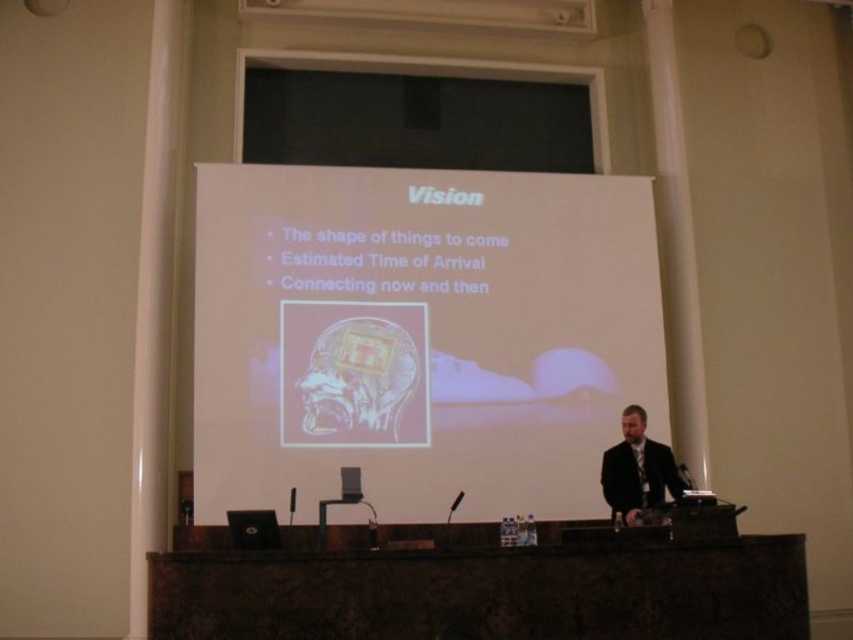
Can you confirm if white matte projection screen at center is bigger than black matte suit at right?

Correct, white matte projection screen at center is larger in size than black matte suit at right.

Is point (206, 392) in front of point (630, 509)?

No, (206, 392) is further to viewer.

Locate an element on the screen. white matte projection screen at center is located at coordinates click(419, 337).

Identify the location of white matte projection screen at center. This screenshot has height=640, width=853. (419, 337).

Which is more to the right, brown marble table at center or black matte suit at right?

black matte suit at right is more to the right.

Is brown marble table at center positioned behind black matte suit at right?

No.

What do you see at coordinates (479, 586) in the screenshot?
I see `brown marble table at center` at bounding box center [479, 586].

Locate an element on the screen. The width and height of the screenshot is (853, 640). brown marble table at center is located at coordinates pos(479,586).

Can you confirm if white matte projection screen at center is bigger than black matte screen at upper center?

Indeed, white matte projection screen at center has a larger size compared to black matte screen at upper center.

Is white matte projection screen at center shorter than black matte screen at upper center?

In fact, white matte projection screen at center may be taller than black matte screen at upper center.

Describe the element at coordinates (419, 337) in the screenshot. I see `white matte projection screen at center` at that location.

Find the location of `white matte projection screen at center`. white matte projection screen at center is located at coordinates (419, 337).